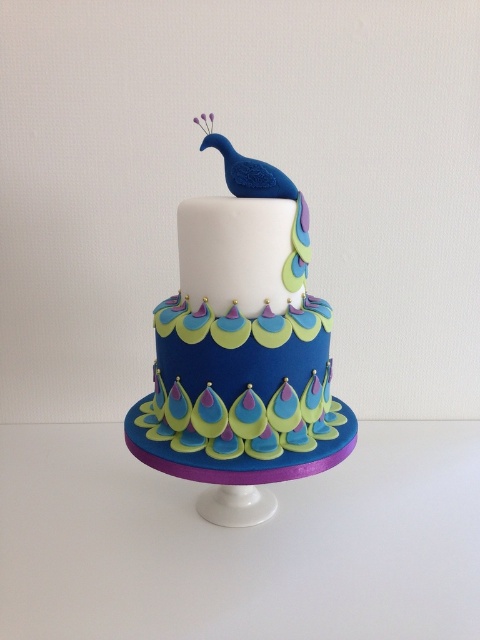
Who is positioned more to the left, matte blue peacock at center or white smooth cake at center?

matte blue peacock at center

Is point (295, 436) closer to camera compared to point (217, 241)?

No, (295, 436) is behind (217, 241).

This screenshot has width=480, height=640. I want to click on matte blue peacock at center, so click(241, 340).

In the scene shown: Can you confirm if white smooth cake at center is taller than blue glossy peacock at top?

Indeed, white smooth cake at center has a greater height compared to blue glossy peacock at top.

Between point (235, 200) and point (244, 172), which one is positioned behind?

Point (244, 172)

Does point (282, 243) come closer to viewer compared to point (255, 163)?

Yes, point (282, 243) is in front of point (255, 163).

Locate an element on the screen. The image size is (480, 640). white smooth cake at center is located at coordinates (236, 252).

Is matte blue peacock at center to the left of blue glossy peacock at top from the viewer's perspective?

Indeed, matte blue peacock at center is positioned on the left side of blue glossy peacock at top.

Which is behind, point (180, 296) or point (264, 195)?

Point (180, 296)

Where is `matte blue peacock at center`? matte blue peacock at center is located at coordinates (241, 340).